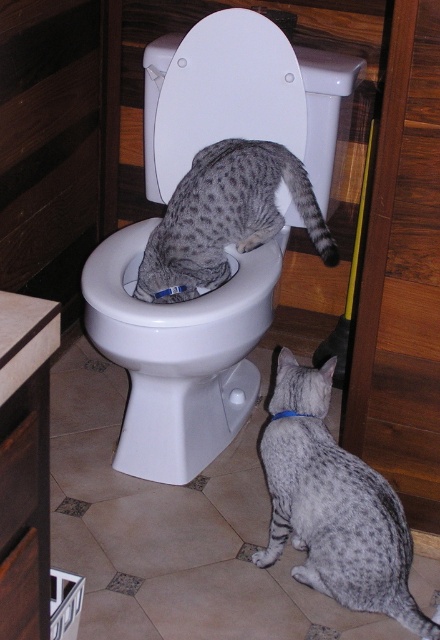
Question: Can you confirm if white glossy toilet bowl at center is positioned to the right of spotted fur cat at lower right?

Choices:
 (A) yes
 (B) no

Answer: (B)

Question: In this image, where is white glossy toilet bowl at center located relative to white glossy toilet lid at center?

Choices:
 (A) above
 (B) below

Answer: (B)

Question: Which object is the farthest from the spotted fur cat at center?

Choices:
 (A) white glossy toilet bowl at center
 (B) white glossy toilet lid at center

Answer: (A)

Question: Among these points, which one is nearest to the camera?

Choices:
 (A) (223, 205)
 (B) (266, 106)
 (C) (261, 324)
 (D) (404, 570)

Answer: (D)

Question: Which object is positioned farthest from the spotted fur cat at lower right?

Choices:
 (A) white glossy toilet bowl at center
 (B) white glossy toilet lid at center

Answer: (B)

Question: Is white glossy toilet bowl at center positioned before spotted fur cat at lower right?

Choices:
 (A) no
 (B) yes

Answer: (A)